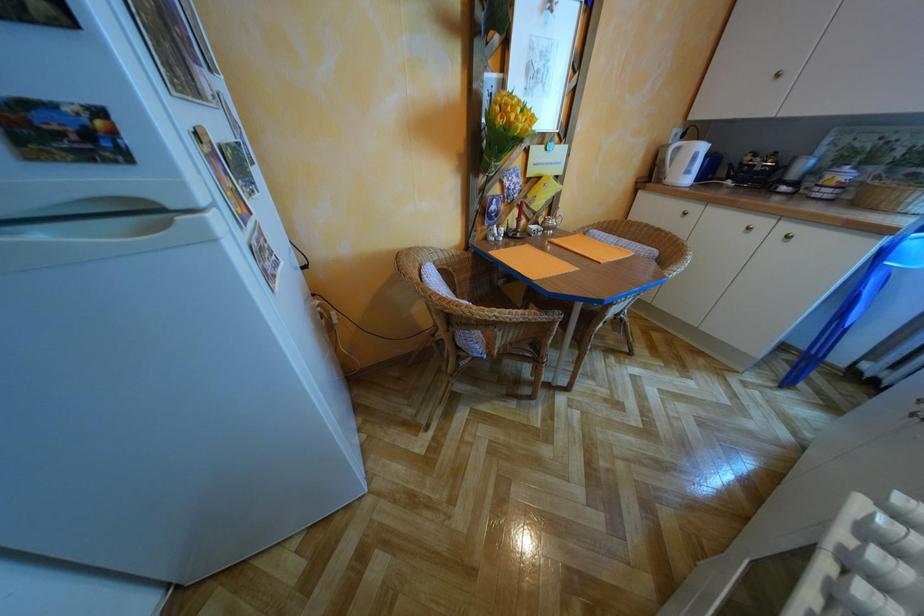
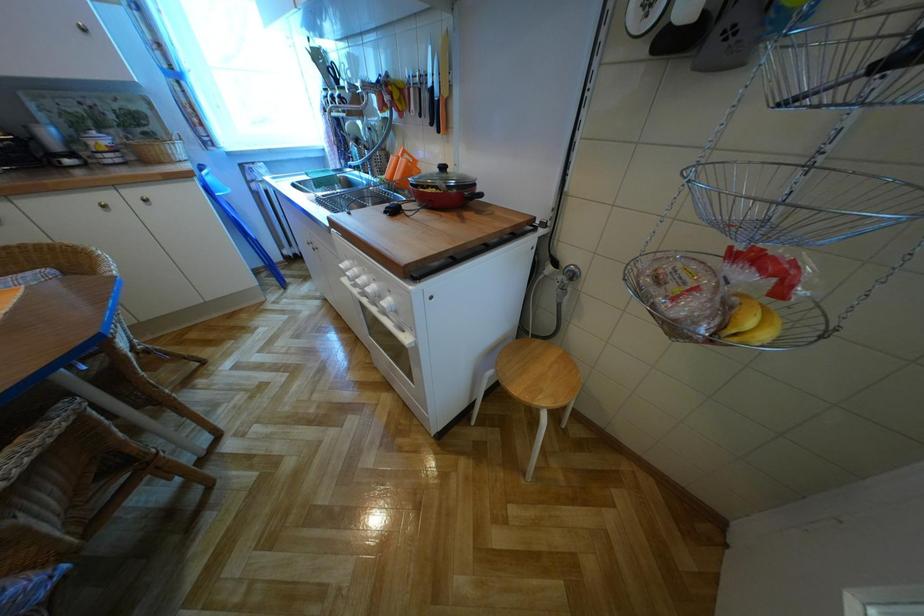
Based on the continuous images, in which direction is the camera rotating?

The rotation direction of the camera is right-down.